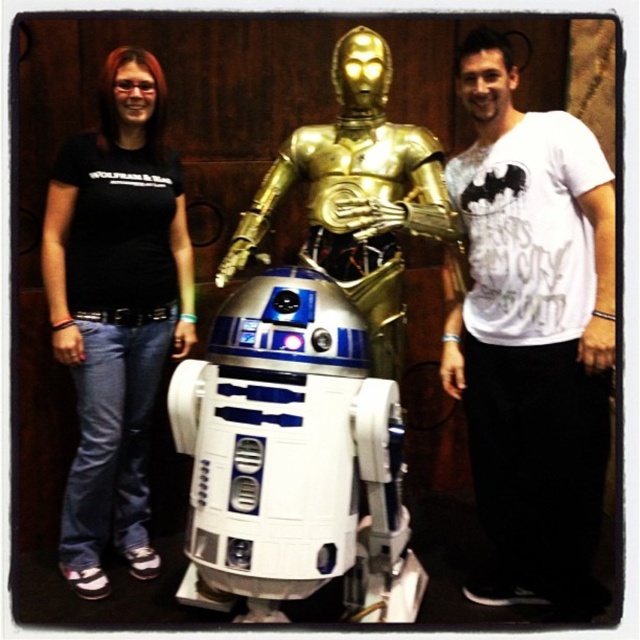
Based on the coordinates provided, which object is located at point (116, 308) in the image?

The point (116, 308) corresponds to the black cotton shirt at left.